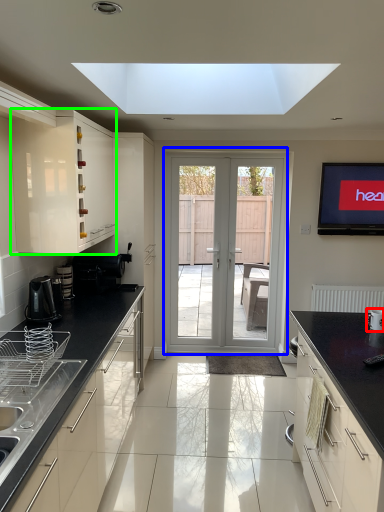
Question: Considering the real-world distances, which object is farthest from appliance (highlighted by a red box)? door (highlighted by a blue box) or cabinetry (highlighted by a green box)?

Choices:
 (A) door
 (B) cabinetry

Answer: (A)